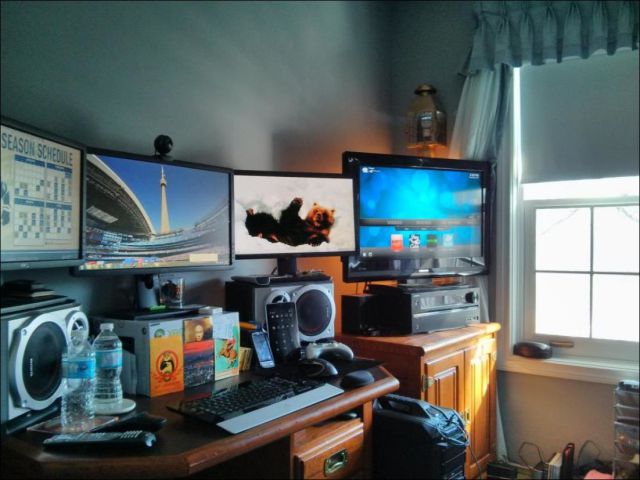
I want to click on game controller, so click(330, 349).